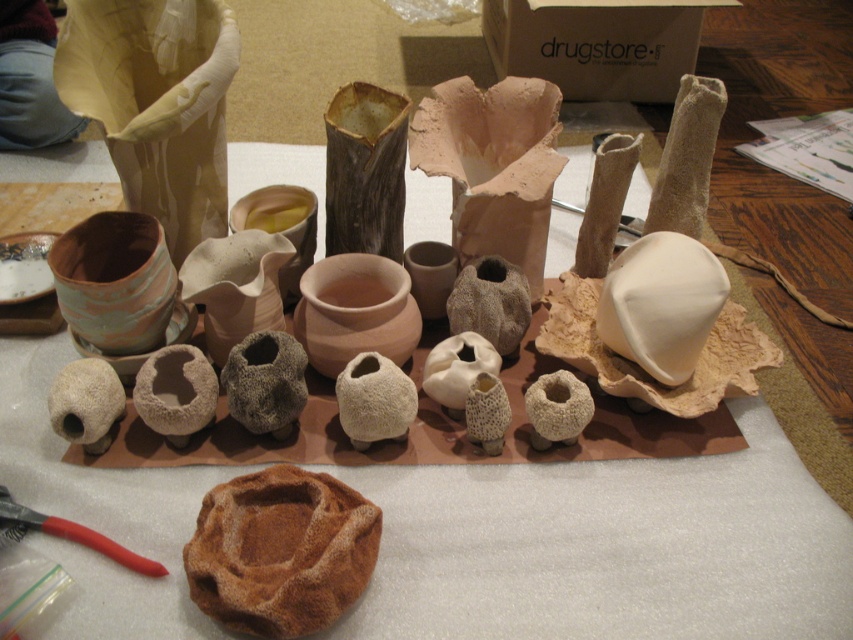
You are an art curator planning to display the matte clay vase at center in a new exhibition. The exhibition requires that the vase must be placed exactly at coordinate point (492,164). Can you confirm if the current arrangement of the ceramics allows this placement?

The matte clay vase at center is already located at point (492,164), so the current arrangement allows this placement.

You are an art curator arranging a display of ceramic pieces. You have a matte clay vase at center and a brown matte vase at center. Which vase should you place in the center of the display to emphasize its size?

The matte clay vase at center is larger, so placing it in the center of the display will emphasize its size.